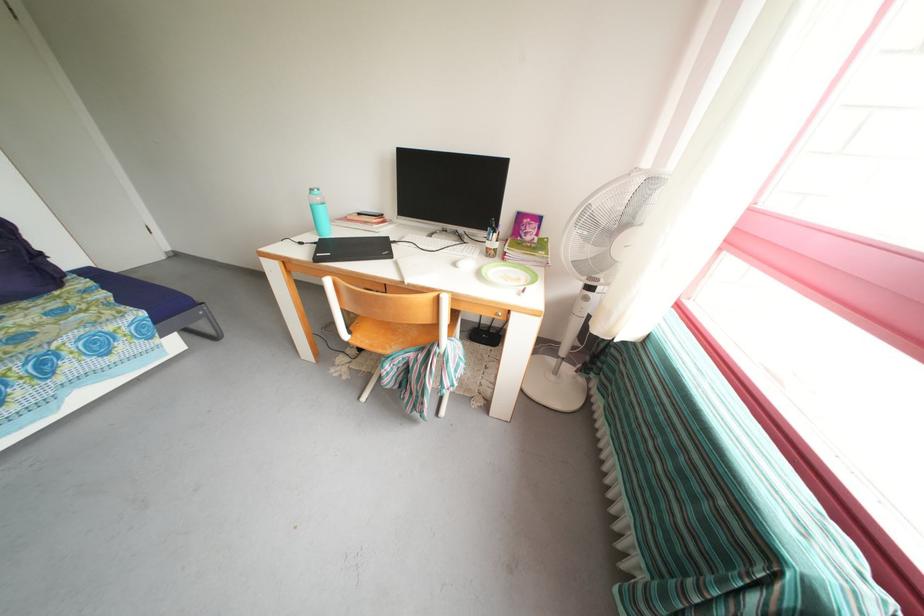
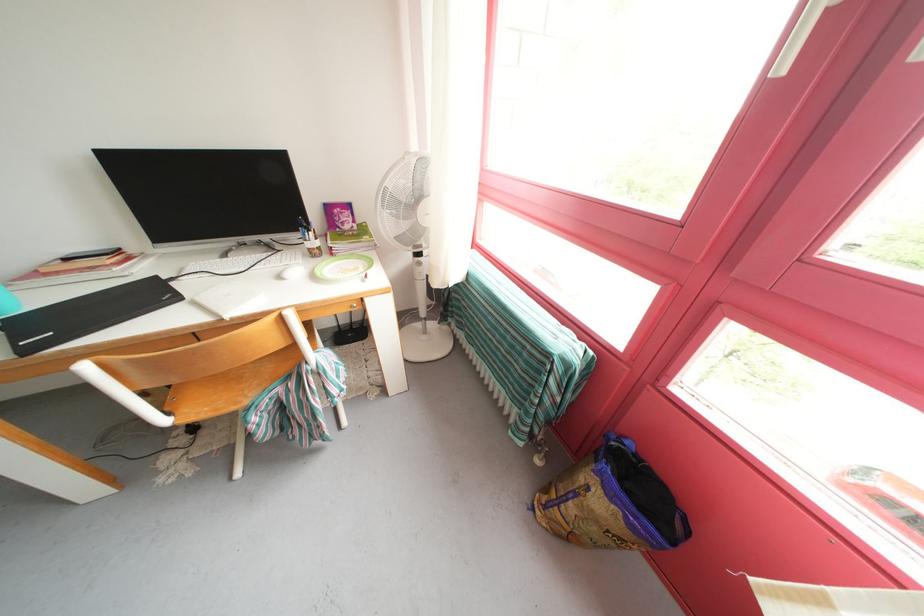
Where in the second image is the point corresponding to (x=365, y=341) from the first image?

(191, 416)